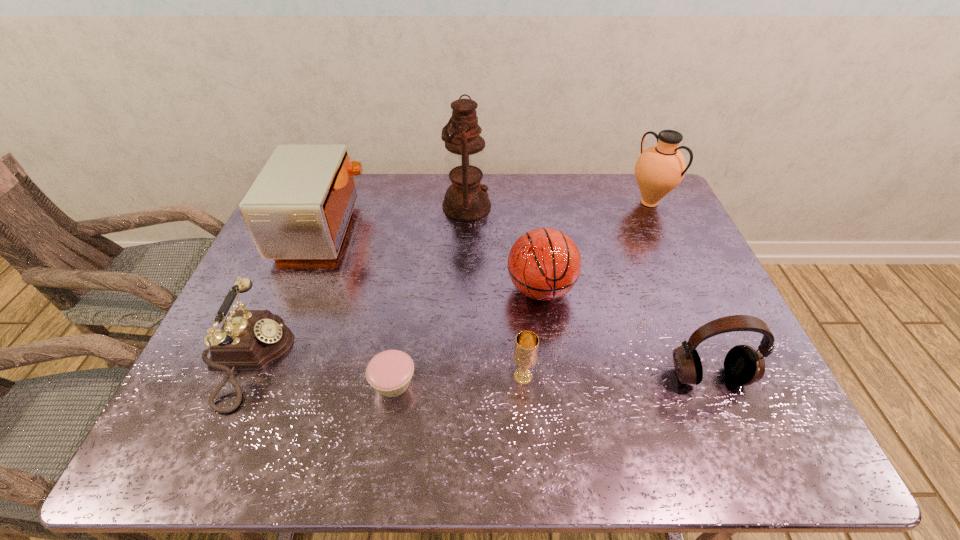
Identify the location of toaster oven present at the far edge. (298, 208).

Identify the location of toaster oven at the left edge. The width and height of the screenshot is (960, 540). (298, 208).

You are a GUI agent. You are given a task and a screenshot of the screen. Output one action in this format:
    pyautogui.click(x=<x>, y=<y>)
    Task: Click on the telephone present at the left edge
    Image resolution: width=960 pixels, height=540 pixels.
    Given the screenshot: What is the action you would take?
    pyautogui.click(x=249, y=340)

You are a GUI agent. You are given a task and a screenshot of the screen. Output one action in this format:
    pyautogui.click(x=<x>, y=<y>)
    Task: Click on the pitcher that is at the right edge
    
    Given the screenshot: What is the action you would take?
    [x=659, y=169]

Where is `headset that is at the right edge`? This screenshot has height=540, width=960. headset that is at the right edge is located at coordinates (743, 365).

Locate an element on the screen. The width and height of the screenshot is (960, 540). object present at the far left corner is located at coordinates (298, 208).

The height and width of the screenshot is (540, 960). I want to click on object that is at the far right corner, so click(x=659, y=169).

The image size is (960, 540). In the image, there is a desktop. Find the location of `free space at the far edge`. free space at the far edge is located at coordinates (543, 211).

What are the coordinates of `vacant space at the left edge of the desktop` in the screenshot? It's located at (278, 264).

Where is `vacant space at the right edge of the desktop`? This screenshot has height=540, width=960. vacant space at the right edge of the desktop is located at coordinates (695, 326).